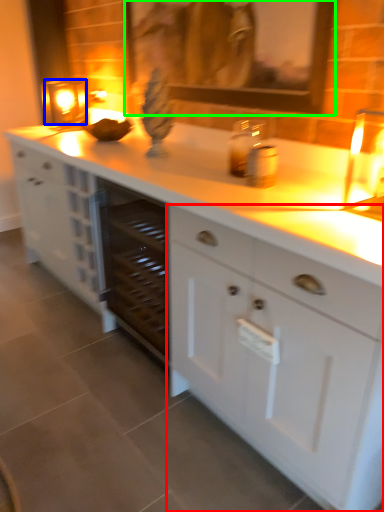
Question: Estimate the real-world distances between objects in this image. Which object is farther from cabinetry (highlighted by a red box), candle holder (highlighted by a blue box) or picture frame (highlighted by a green box)?

Choices:
 (A) candle holder
 (B) picture frame

Answer: (A)